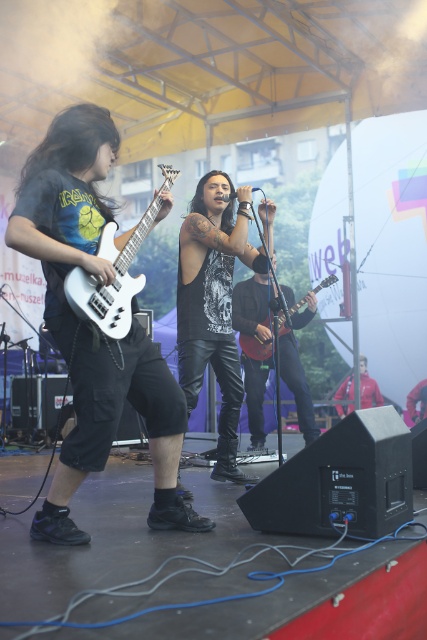
Is matte black guitar at left thinner than black leather guitar at center?

Incorrect, matte black guitar at left's width is not less than black leather guitar at center's.

Is matte black guitar at left behind black leather guitar at center?

No, it is not.

Does point (90, 106) come in front of point (303, 310)?

Yes, it is.

At what (x,y) coordinates should I click in order to perform the action: click on matte black guitar at left. Please return your answer as a coordinate pair (x, y). The height and width of the screenshot is (640, 427). Looking at the image, I should click on click(116, 429).

Is point (365, 374) positioned behind point (283, 326)?

Yes, point (365, 374) is farther from viewer.

Find the location of `red jacket at center`. red jacket at center is located at coordinates (368, 387).

Which of these two, matte red electric guitar at center or dark gray leather jacket at center, stands shorter?

dark gray leather jacket at center is shorter.

Is point (333, 276) farther from viewer compared to point (421, 408)?

No, it is in front of (421, 408).

Is point (294, 305) more distant than point (417, 388)?

No, it is in front of (417, 388).

This screenshot has height=640, width=427. In order to click on matte red electric guitar at center in this screenshot , I will do `click(256, 346)`.